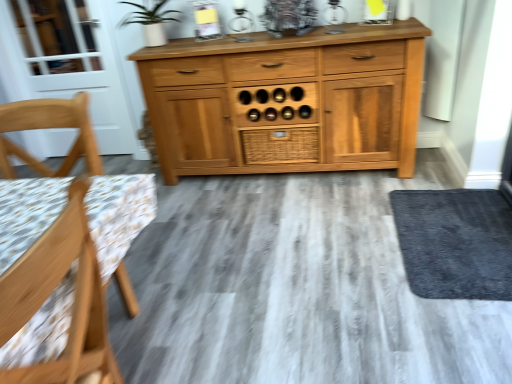
In order to face dark gray carpet at lower right, should I rotate leftwards or rightwards?

You should rotate right by 25.686 degrees.

The image size is (512, 384). Find the location of `light wood chair at left, which is the second chair from front to back`. light wood chair at left, which is the second chair from front to back is located at coordinates (49, 128).

From the image's perspective, is dark gray carpet at lower right positioned above or below white glass screen door at left?

From the image's perspective, dark gray carpet at lower right appears below white glass screen door at left.

Who is taller, dark gray carpet at lower right or white glass screen door at left?

Standing taller between the two is white glass screen door at left.

Which object is positioned more to the left, dark gray carpet at lower right or white glass screen door at left?

white glass screen door at left is more to the left.

Which point is more forward, (495, 248) or (3, 37)?

The point (495, 248) is closer to the camera.

Are white glass screen door at left and wooden chair at left, which is counted as the 2th chair, starting from the back, beside each other?

No, white glass screen door at left is not making contact with wooden chair at left, which is counted as the 2th chair, starting from the back.

Looking at this image, between white glass screen door at left and wooden chair at left, which appears as the first chair when viewed from the front, which one has larger size?

With larger size is wooden chair at left, which appears as the first chair when viewed from the front.

Considering the relative positions of white glass screen door at left and wooden chair at left, which is counted as the 2th chair, starting from the back, in the image provided, is white glass screen door at left to the left of wooden chair at left, which is counted as the 2th chair, starting from the back, from the viewer's perspective?

Indeed, white glass screen door at left is positioned on the left side of wooden chair at left, which is counted as the 2th chair, starting from the back.

Is white glass screen door at left facing away from wooden chair at left, which is counted as the 2th chair, starting from the back?

white glass screen door at left does not have its back to wooden chair at left, which is counted as the 2th chair, starting from the back.

What's the angular difference between light wood chair at left, which ranks as the 1th chair in back-to-front order, and dark gray carpet at lower right's facing directions?

90.3 degrees separate the facing orientations of light wood chair at left, which ranks as the 1th chair in back-to-front order, and dark gray carpet at lower right.

Is point (50, 100) positioned before point (453, 263)?

Yes, it is in front of point (453, 263).

Could you measure the distance between light wood chair at left, which is the second chair from front to back, and dark gray carpet at lower right?

The distance of light wood chair at left, which is the second chair from front to back, from dark gray carpet at lower right is 1.65 meters.

Are light wood chair at left, which ranks as the 1th chair in back-to-front order, and dark gray carpet at lower right far apart?

Yes, light wood chair at left, which ranks as the 1th chair in back-to-front order, is far from dark gray carpet at lower right.

From a real-world perspective, between white glass screen door at left and woven wood drawer at center, who is vertically lower?

woven wood drawer at center, from a real-world perspective.

Is white glass screen door at left further to camera compared to woven wood drawer at center?

Yes, white glass screen door at left is further from the camera.

Is white glass screen door at left shorter than woven wood drawer at center?

In fact, white glass screen door at left may be taller than woven wood drawer at center.

Are wooden chair at left, which is counted as the 2th chair, starting from the back, and white glass screen door at left far apart?

wooden chair at left, which is counted as the 2th chair, starting from the back, is positioned a significant distance from white glass screen door at left.

Is wooden chair at left, which is counted as the 2th chair, starting from the back, smaller than white glass screen door at left?

Actually, wooden chair at left, which is counted as the 2th chair, starting from the back, might be larger than white glass screen door at left.

In the image, is wooden chair at left, which appears as the first chair when viewed from the front, positioned in front of or behind white glass screen door at left?

Clearly, wooden chair at left, which appears as the first chair when viewed from the front, is in front of white glass screen door at left.

Considering the sizes of objects dark gray carpet at lower right and light wood chair at left, which is the second chair from front to back, in the image provided, who is shorter, dark gray carpet at lower right or light wood chair at left, which is the second chair from front to back,?

Standing shorter between the two is dark gray carpet at lower right.

Does dark gray carpet at lower right appear on the left side of light wood chair at left, which is the second chair from front to back?

No.

Does point (490, 227) lie in front of point (5, 154)?

That is False.

Image resolution: width=512 pixels, height=384 pixels. What are the coordinates of `door that is on the right side of light wood chair at left, which ranks as the 1th chair in back-to-front order` in the screenshot? It's located at (455, 242).

Is light wood chair at left, which is the second chair from front to back, at the right side of woven wood drawer at center?

Incorrect, light wood chair at left, which is the second chair from front to back, is not on the right side of woven wood drawer at center.

Is point (27, 108) positioned after point (313, 161)?

That is False.

Can you confirm if light wood chair at left, which is the second chair from front to back, is bigger than woven wood drawer at center?

Yes, light wood chair at left, which is the second chair from front to back, is bigger than woven wood drawer at center.

Which object is more forward, light wood chair at left, which is the second chair from front to back, or woven wood drawer at center?

Positioned in front is light wood chair at left, which is the second chair from front to back.

At what (x,y) coordinates should I click in order to perform the action: click on screen door to the left of dark gray carpet at lower right. Please return your answer as a coordinate pair (x, y). This screenshot has height=384, width=512. Looking at the image, I should click on (76, 63).

This screenshot has width=512, height=384. I want to click on the 2nd chair below the white glass screen door at left (from the image's perspective), so click(x=53, y=290).

When comparing their distances from white glass screen door at left, does dark gray carpet at lower right or woven wood drawer at center seem closer?

The object closer to white glass screen door at left is woven wood drawer at center.

Looking at the image, which one is located further to dark gray carpet at lower right, wooden chair at left, which appears as the first chair when viewed from the front, or light wood chair at left, which is the second chair from front to back?

The object further to dark gray carpet at lower right is light wood chair at left, which is the second chair from front to back.

Looking at the image, which one is located further to white glass screen door at left, light wood chair at left, which ranks as the 1th chair in back-to-front order, or woven wood drawer at center?

The object further to white glass screen door at left is light wood chair at left, which ranks as the 1th chair in back-to-front order.

Based on their spatial positions, is dark gray carpet at lower right or woven wood drawer at center further from light wood chair at left, which ranks as the 1th chair in back-to-front order?

Based on the image, dark gray carpet at lower right appears to be further to light wood chair at left, which ranks as the 1th chair in back-to-front order.

Consider the image. Estimate the real-world distances between objects in this image. Which object is closer to wooden chair at left, which is counted as the 2th chair, starting from the back, light wood chair at left, which is the second chair from front to back, or woven wood drawer at center?

Among the two, light wood chair at left, which is the second chair from front to back, is located nearer to wooden chair at left, which is counted as the 2th chair, starting from the back.

Considering their positions, is woven wood drawer at center positioned closer to wooden chair at left, which appears as the first chair when viewed from the front, than light wood chair at left, which is the second chair from front to back?

light wood chair at left, which is the second chair from front to back.

Based on the photo, considering their positions, is light wood chair at left, which is the second chair from front to back, positioned further to wooden chair at left, which appears as the first chair when viewed from the front, than white glass screen door at left?

white glass screen door at left.

Estimate the real-world distances between objects in this image. Which object is closer to woven wood drawer at center, light wood chair at left, which is the second chair from front to back, or wooden chair at left, which is counted as the 2th chair, starting from the back?

light wood chair at left, which is the second chair from front to back, lies closer to woven wood drawer at center than the other object.

Find the location of a particular element. chair situated between light wood chair at left, which ranks as the 1th chair in back-to-front order, and dark gray carpet at lower right from left to right is located at coordinates (53, 290).

Where is `chair between wooden chair at left, which appears as the first chair when viewed from the front, and white glass screen door at left from front to back`? This screenshot has height=384, width=512. chair between wooden chair at left, which appears as the first chair when viewed from the front, and white glass screen door at left from front to back is located at coordinates (49, 128).

You are a GUI agent. You are given a task and a screenshot of the screen. Output one action in this format:
    pyautogui.click(x=<x>, y=<y>)
    Task: Click on the drawer positioned between light wood chair at left, which is the second chair from front to back, and white glass screen door at left from near to far
    The image size is (512, 384).
    Given the screenshot: What is the action you would take?
    pyautogui.click(x=280, y=145)

Locate an element on the screen. drawer between wooden chair at left, which appears as the first chair when viewed from the front, and white glass screen door at left in the front-back direction is located at coordinates (280, 145).